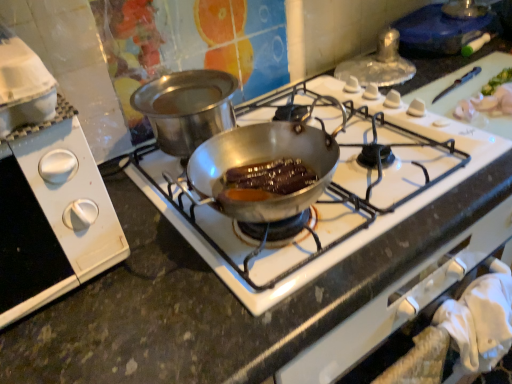
Question: Considering the positions of shiny silver pan at center and white plastic stove knobs at left in the image, is shiny silver pan at center wider or thinner than white plastic stove knobs at left?

Choices:
 (A) thin
 (B) wide

Answer: (B)

Question: From a real-world perspective, is shiny silver pan at center positioned above or below white plastic stove knobs at left?

Choices:
 (A) above
 (B) below

Answer: (B)

Question: Do you think shiny silver pan at center is within white plastic stove knobs at left, or outside of it?

Choices:
 (A) inside
 (B) outside

Answer: (B)

Question: Considering the positions of point (84, 210) and point (202, 241), is point (84, 210) closer or farther from the camera than point (202, 241)?

Choices:
 (A) closer
 (B) farther

Answer: (A)

Question: Is white plastic stove knobs at left taller or shorter than shiny silver pan at center?

Choices:
 (A) tall
 (B) short

Answer: (A)

Question: Considering the positions of white plastic stove knobs at left and shiny silver pan at center in the image, is white plastic stove knobs at left bigger or smaller than shiny silver pan at center?

Choices:
 (A) small
 (B) big

Answer: (A)

Question: Considering their positions, is white plastic stove knobs at left located in front of or behind shiny silver pan at center?

Choices:
 (A) front
 (B) behind

Answer: (A)